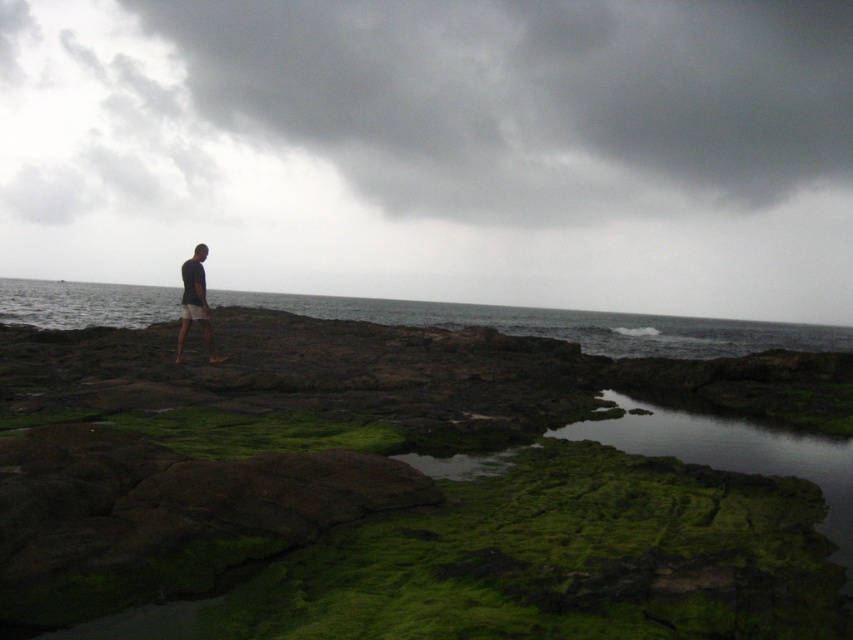
Question: Is gray water at center bigger than dark gray t-shirt at center?

Choices:
 (A) no
 (B) yes

Answer: (B)

Question: Which of the following is the closest to the observer?

Choices:
 (A) 349,307
 (B) 199,262

Answer: (B)

Question: Which point appears closest to the camera in this image?

Choices:
 (A) coord(199,308)
 (B) coord(657,353)

Answer: (A)

Question: In this image, where is gray water at center located relative to dark gray t-shirt at center?

Choices:
 (A) right
 (B) left

Answer: (B)

Question: Is gray water at center to the right of dark gray t-shirt at center from the viewer's perspective?

Choices:
 (A) yes
 (B) no

Answer: (B)

Question: Which point appears closest to the camera in this image?

Choices:
 (A) (206, 333)
 (B) (700, 348)

Answer: (A)